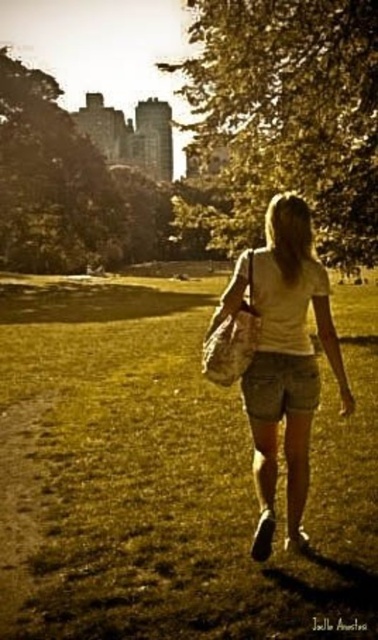
Question: Is matte beige shorts at center smaller than denim shorts at center?

Choices:
 (A) yes
 (B) no

Answer: (B)

Question: Which point is farther to the camera?

Choices:
 (A) (29, 483)
 (B) (368, 67)
 (C) (275, 284)

Answer: (B)

Question: Is green leafy tree at upper center wider than matte beige shorts at center?

Choices:
 (A) yes
 (B) no

Answer: (A)

Question: Which object is positioned closest to the green leafy tree at upper center?

Choices:
 (A) brown dirt path at lower left
 (B) green grassy field at center
 (C) denim shorts at center
 (D) green leafy tree at upper left

Answer: (B)

Question: Can you confirm if brown dirt path at lower left is thinner than denim shorts at center?

Choices:
 (A) no
 (B) yes

Answer: (A)

Question: Which point is farther to the camera?

Choices:
 (A) green leafy tree at upper left
 (B) brown dirt path at lower left

Answer: (A)